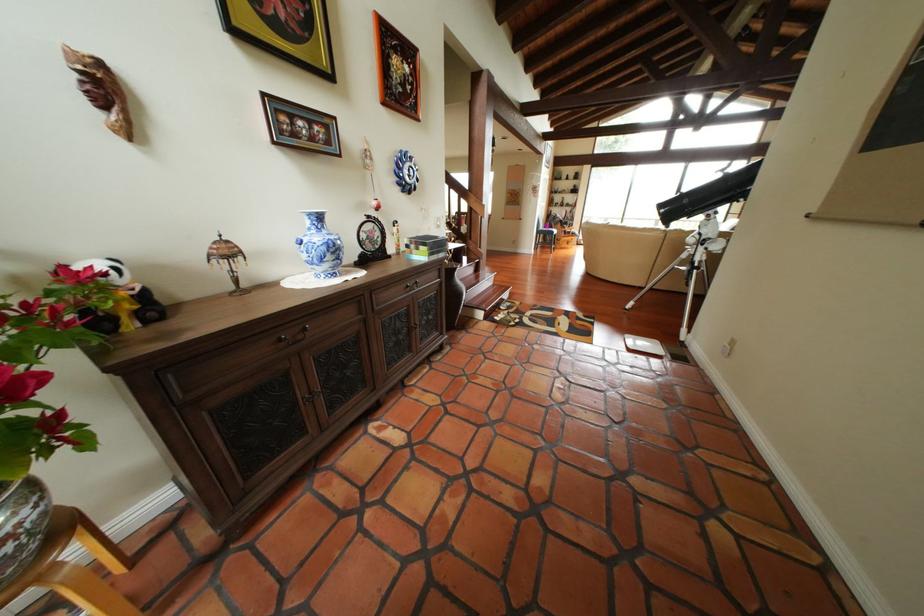
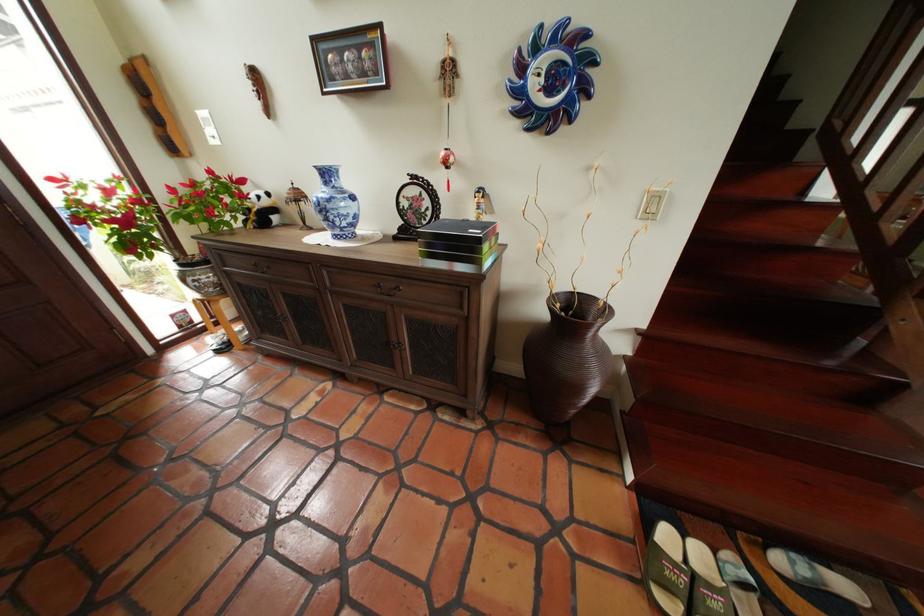
The point at (353, 252) is marked in the first image. Where is the corresponding point in the second image?

(341, 214)